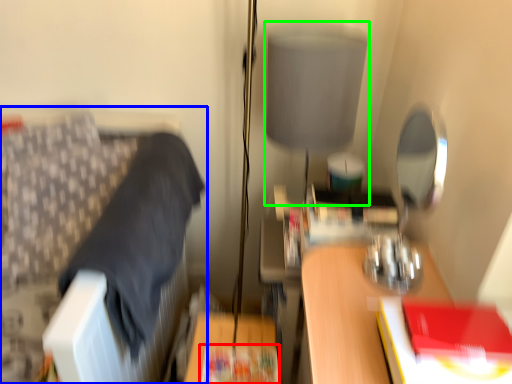
Question: Estimate the real-world distances between objects in this image. Which object is closer to paperback book (highlighted by a red box), furniture (highlighted by a blue box) or table lamp (highlighted by a green box)?

Choices:
 (A) furniture
 (B) table lamp

Answer: (A)